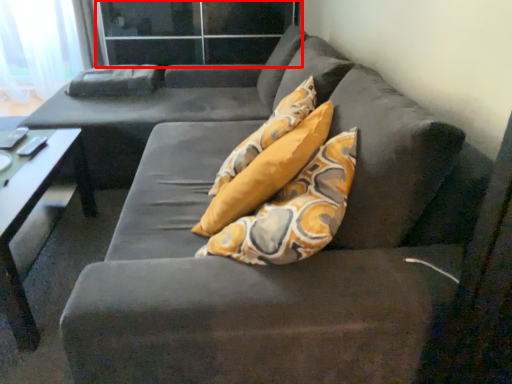
Question: Where is glass door (annotated by the red box) located in relation to table in the image?

Choices:
 (A) left
 (B) right

Answer: (B)